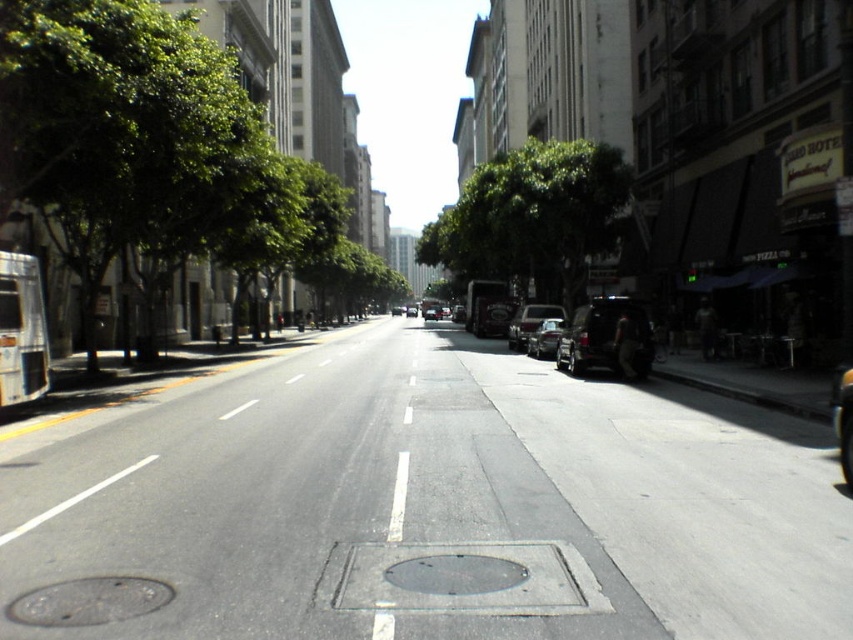
Between dark gray metallic van at center-right and shiny silver car at center, which one appears on the left side from the viewer's perspective?

shiny silver car at center

Where is `dark gray metallic van at center-right`? This screenshot has height=640, width=853. dark gray metallic van at center-right is located at coordinates (604, 337).

This screenshot has height=640, width=853. I want to click on dark gray metallic van at center-right, so click(x=604, y=337).

Where is `dark gray metallic van at center-right`? The image size is (853, 640). dark gray metallic van at center-right is located at coordinates (604, 337).

Which of these two, green leafy tree at left or green leafy tree at center, stands shorter?

With less height is green leafy tree at left.

Describe the element at coordinates (155, 150) in the screenshot. Image resolution: width=853 pixels, height=640 pixels. I see `green leafy tree at left` at that location.

At what (x,y) coordinates should I click in order to perform the action: click on green leafy tree at left. Please return your answer as a coordinate pair (x, y). This screenshot has height=640, width=853. Looking at the image, I should click on (155, 150).

Does green leafy tree at left lie behind shiny silver sedan at center?

No, green leafy tree at left is in front of shiny silver sedan at center.

How distant is green leafy tree at left from shiny silver sedan at center?

The distance of green leafy tree at left from shiny silver sedan at center is 50.09 feet.

Does point (363, 257) come in front of point (537, 305)?

No, it is behind (537, 305).

I want to click on green leafy tree at left, so click(155, 150).